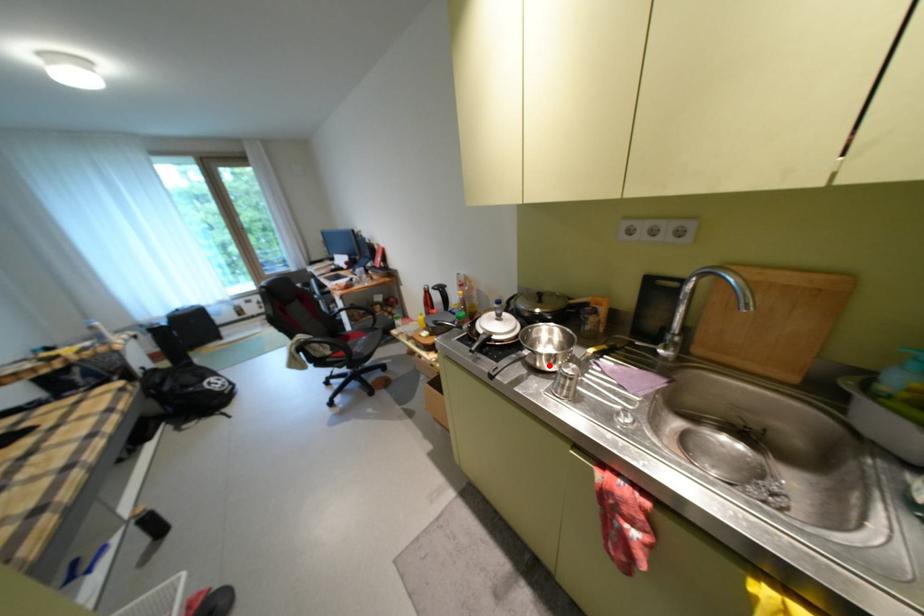
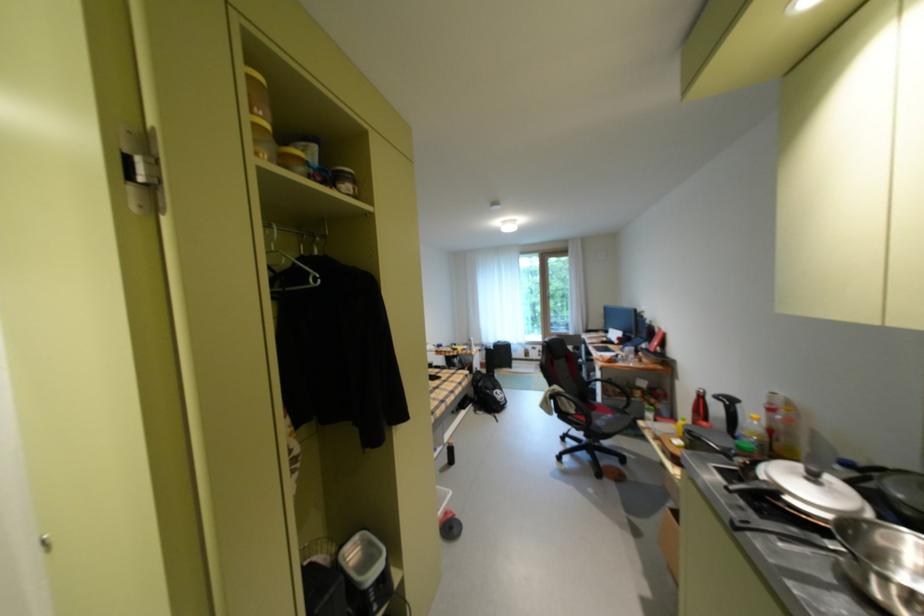
Find the pixel in the second image that matches the highlighted location in the first image.

(888, 594)